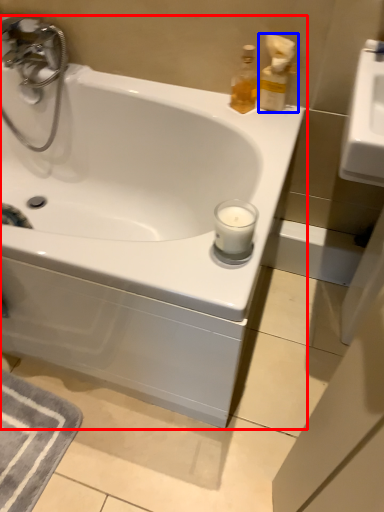
Question: Which point is closer to the camera, bathtub (highlighted by a red box) or soap dispenser (highlighted by a blue box)?

Choices:
 (A) bathtub
 (B) soap dispenser

Answer: (A)